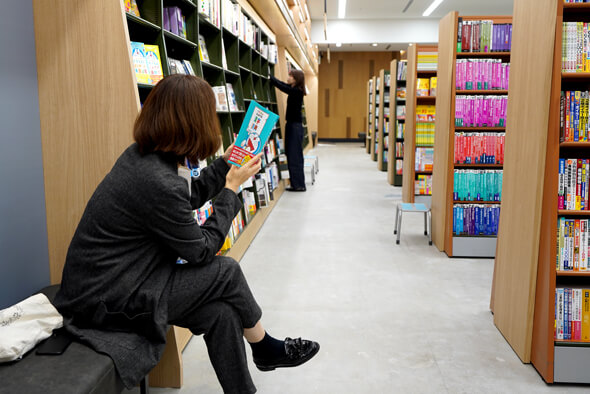
At what (x,y) coordinates should I click in order to perform the action: click on books. Please return your answer as a coordinate pair (x, y). Looking at the image, I should click on (476, 147), (254, 122), (137, 52), (435, 130), (388, 136).